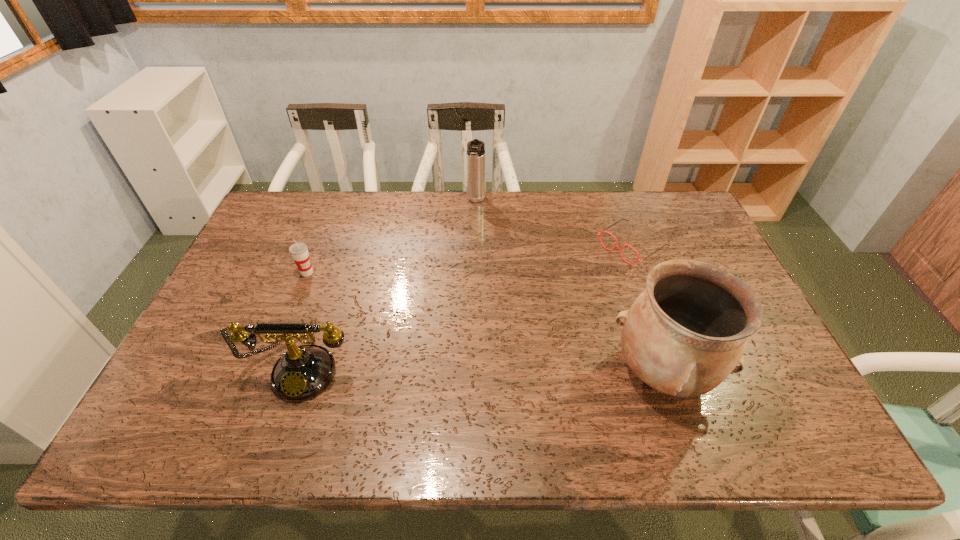
Identify the location of free space that is in between the thermos bottle and the tallest object. The height and width of the screenshot is (540, 960). (569, 286).

Where is `unoccupied position between the tallest object and the second shortest object`? This screenshot has height=540, width=960. unoccupied position between the tallest object and the second shortest object is located at coordinates (485, 322).

Where is `free spot between the spectacles and the cup`? The width and height of the screenshot is (960, 540). free spot between the spectacles and the cup is located at coordinates (469, 259).

The width and height of the screenshot is (960, 540). In order to click on unoccupied position between the cup and the telephone in this screenshot , I will do `click(305, 320)`.

I want to click on vacant area between the tallest object and the second shortest object, so click(485, 322).

Where is `object that can be found as the second closest to the tallest object`? This screenshot has width=960, height=540. object that can be found as the second closest to the tallest object is located at coordinates (302, 372).

Where is `object that is the fourth nearest to the shortest object`? This screenshot has height=540, width=960. object that is the fourth nearest to the shortest object is located at coordinates point(299,252).

I want to click on free point that satisfies the following two spatial constraints: 1. on the front side of the spectacles; 2. on the right side of the thermos bottle, so click(476, 245).

The width and height of the screenshot is (960, 540). I want to click on vacant space that satisfies the following two spatial constraints: 1. on the back side of the shortest object; 2. on the left side of the second shortest object, so click(318, 245).

Identify the location of blank space that satisfies the following two spatial constraints: 1. on the back side of the second shortest object; 2. on the right side of the shortest object. The image size is (960, 540). (318, 245).